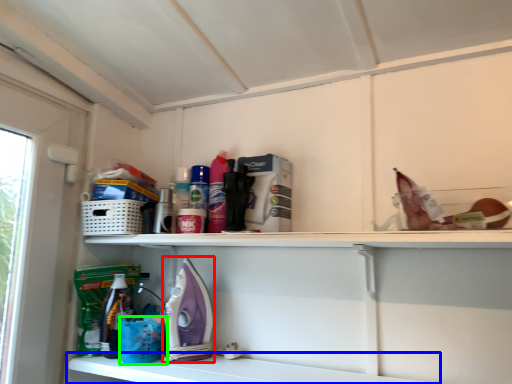
Question: Which is nearer to the appliance (highlighted by a red box)? shelf (highlighted by a blue box) or basket (highlighted by a green box).

Choices:
 (A) shelf
 (B) basket

Answer: (B)